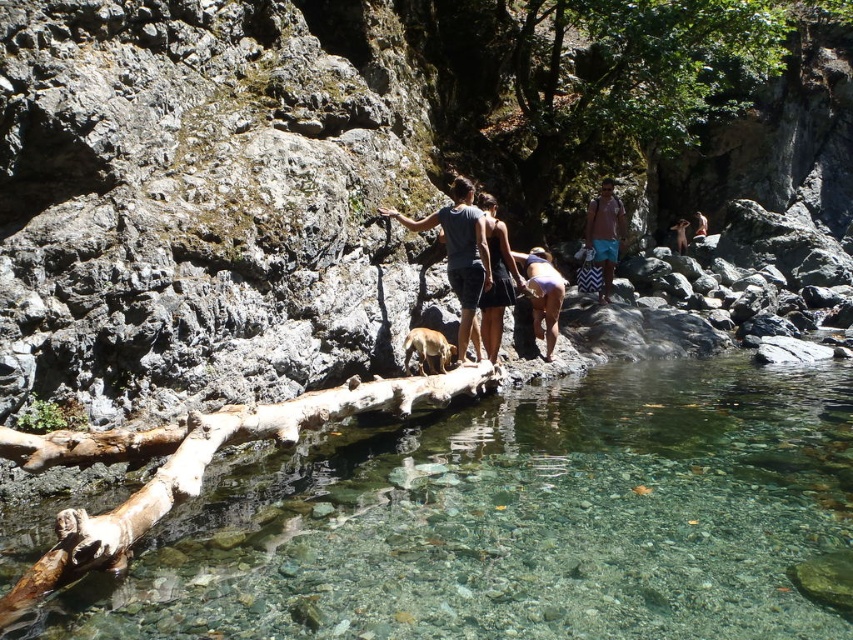
You are a photographer standing at the edge of the stream. You want to take a photo that includes both the brown furry dog at center and the brown leather jacket at upper right. Which object should you adjust your camera angle to include first if you need to ensure both are in frame?

The brown furry dog at center is shorter than the brown leather jacket at upper right, so you should adjust your camera angle to include the brown leather jacket at upper right first, as it is taller and might be out of frame if not properly positioned.

You are a photographer trying to capture the brown furry dog at center and the light brown wooden stick at center in the same frame. Which object will appear narrower in the photo?

The brown furry dog at center is thinner than the light brown wooden stick at center, so it will appear narrower in the photo.

You are a photographer trying to capture a group photo of the dark gray fabric dress at center and the brown furry dog at center by the stream. Since you want both subjects to appear equally prominent in the photo, which subject should you move closer to the camera?

You should move the brown furry dog at center closer to the camera because the dark gray fabric dress at center is larger in size than the brown furry dog at center, so moving the smaller subject forward will balance their sizes in the photo.